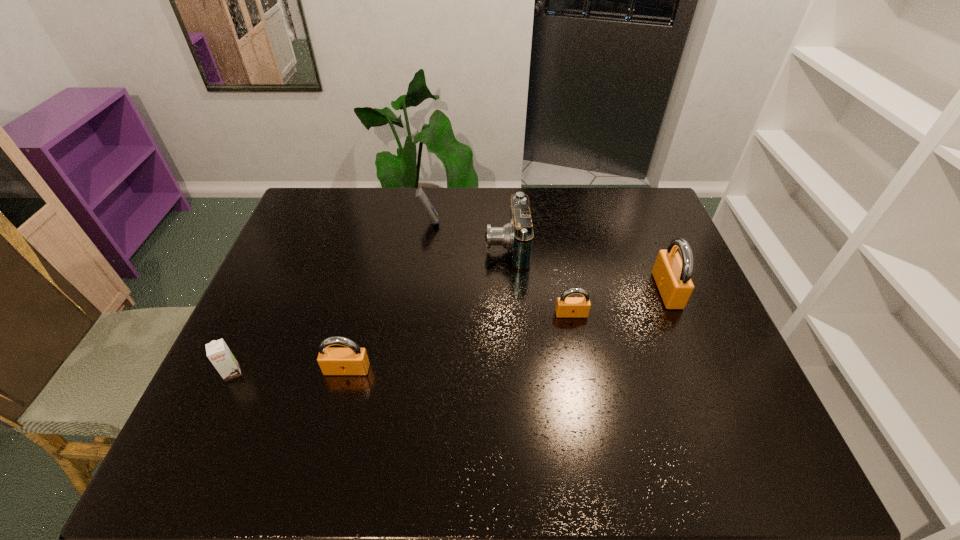
The height and width of the screenshot is (540, 960). I want to click on camcorder present at the far edge, so click(516, 236).

Locate an element on the screen. The height and width of the screenshot is (540, 960). object at the left edge is located at coordinates (219, 354).

Identify the location of object located at the right edge. This screenshot has height=540, width=960. (672, 275).

In the image, there is a desktop. Identify the location of vacant space at the far edge. The width and height of the screenshot is (960, 540). (411, 220).

In the image, there is a desktop. At what (x,y) coordinates should I click in order to perform the action: click on vacant area at the near edge. Please return your answer as a coordinate pair (x, y). The width and height of the screenshot is (960, 540). Looking at the image, I should click on (588, 422).

Where is `vacant space at the left edge of the desktop`? The width and height of the screenshot is (960, 540). vacant space at the left edge of the desktop is located at coordinates (319, 259).

In the image, there is a desktop. At what (x,y) coordinates should I click in order to perform the action: click on blank space at the right edge. Please return your answer as a coordinate pair (x, y). The height and width of the screenshot is (540, 960). Looking at the image, I should click on (701, 293).

Find the location of a particular element. vacant space at the far left corner of the desktop is located at coordinates (337, 205).

Locate an element on the screen. The height and width of the screenshot is (540, 960). vacant region at the far right corner is located at coordinates (639, 194).

Where is `free point between the chocolate milk and the camcorder`? The height and width of the screenshot is (540, 960). free point between the chocolate milk and the camcorder is located at coordinates (370, 309).